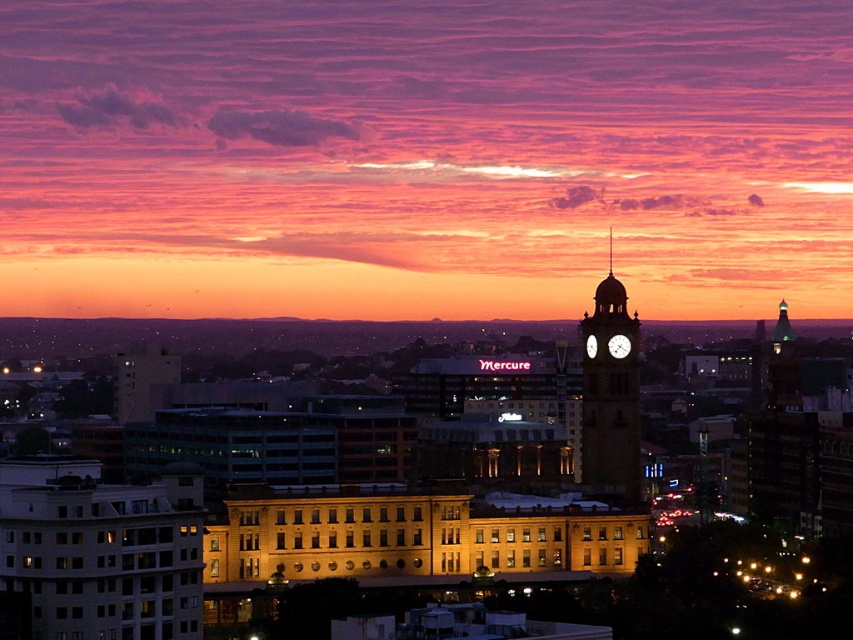
Is matte gold clock tower at center positioned before metallic clock face at center?

That is False.

Identify the location of matte gold clock tower at center. Image resolution: width=853 pixels, height=640 pixels. (608, 296).

Is white glossy clock tower at center closer to camera compared to white glossy clock at center-right?

Yes, white glossy clock tower at center is in front of white glossy clock at center-right.

Who is more forward, (619, 440) or (596, 339)?

Point (619, 440) is in front.

Locate an element on the screen. white glossy clock tower at center is located at coordinates (610, 396).

Who is higher up, white glossy clock tower at center or matte gold clock tower at center?

Positioned higher is matte gold clock tower at center.

Is point (605, 368) positioned before point (611, 285)?

Yes, point (605, 368) is in front of point (611, 285).

You are a GUI agent. You are given a task and a screenshot of the screen. Output one action in this format:
    pyautogui.click(x=<x>, y=<y>)
    Task: Click on the white glossy clock tower at center
    The height and width of the screenshot is (640, 853).
    Given the screenshot: What is the action you would take?
    pyautogui.click(x=610, y=396)